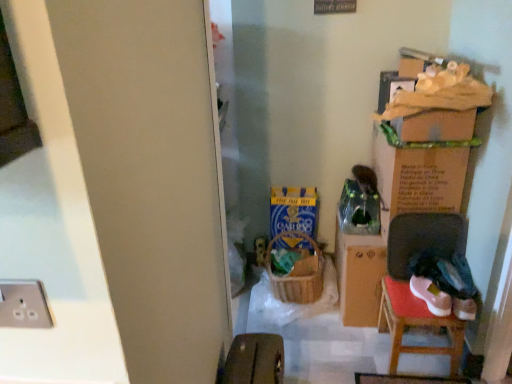
I want to click on free location to the left of wooden chair at lower right, so click(x=359, y=351).